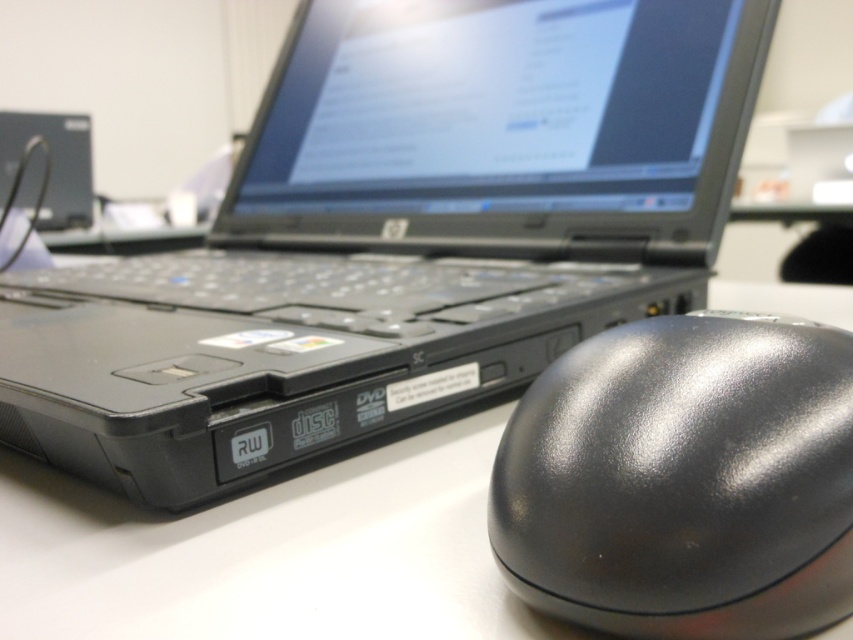
You are trying to place a 12 inch ruler between the black matte laptop at center and the white matte table at center. Can the ruler fit entirely within the space between them?

The distance between the black matte laptop at center and the white matte table at center is 12.25 inches, so a 12 inch ruler can fit entirely within the space between them.

You are trying to reach for the glossy black mouse at lower right while your hand is currently near the black matte laptop at center. Which object is closer to you as you reach?

The glossy black mouse at lower right is closer to you because the black matte laptop at center is further away from the viewer, so you will reach the glossy black mouse at lower right first.